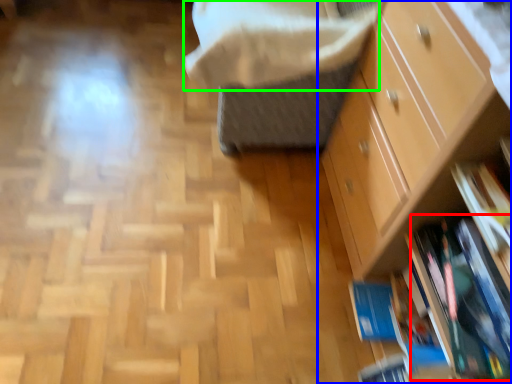
Question: Estimate the real-world distances between objects in this image. Which object is closer to book (highlighted by a red box), chest of drawers (highlighted by a blue box) or blanket (highlighted by a green box)?

Choices:
 (A) chest of drawers
 (B) blanket

Answer: (A)